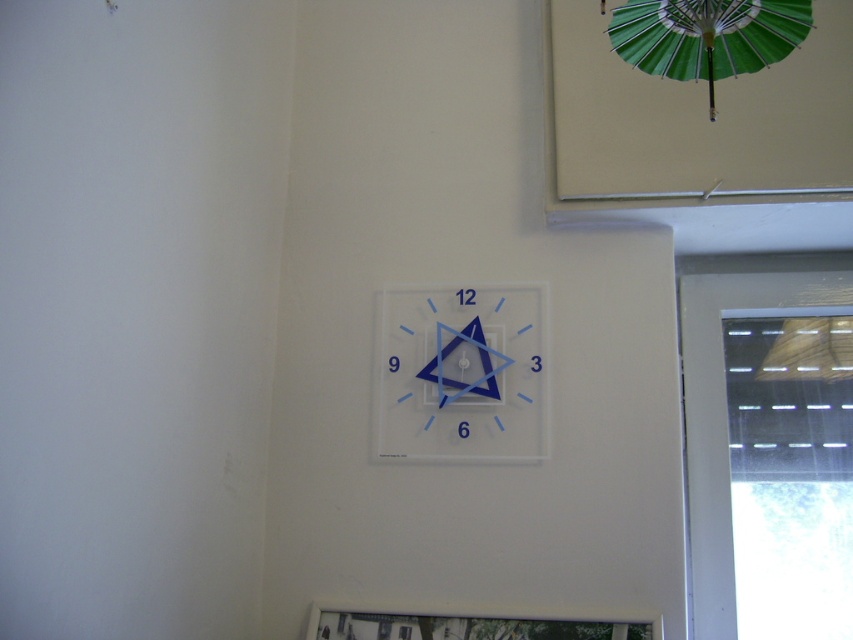
Question: Which of the following is the closest to the observer?

Choices:
 (A) (645, 42)
 (B) (480, 372)

Answer: (A)

Question: Does transparent plastic clock at center appear under green paper umbrella at upper right?

Choices:
 (A) yes
 (B) no

Answer: (A)

Question: Does transparent plastic clock at center appear under green paper umbrella at upper right?

Choices:
 (A) no
 (B) yes

Answer: (B)

Question: Which point is farther to the camera?

Choices:
 (A) (393, 312)
 (B) (700, 52)

Answer: (A)

Question: Observing the image, what is the correct spatial positioning of transparent plastic clock at center in reference to green paper umbrella at upper right?

Choices:
 (A) below
 (B) above

Answer: (A)